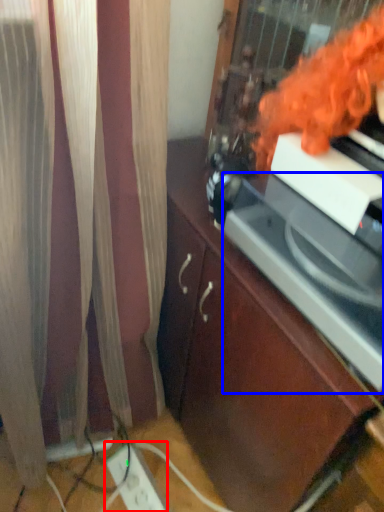
Question: Which of the following is the farthest to the observer, extension cord (highlighted by a red box) or appliance (highlighted by a blue box)?

Choices:
 (A) extension cord
 (B) appliance

Answer: (A)